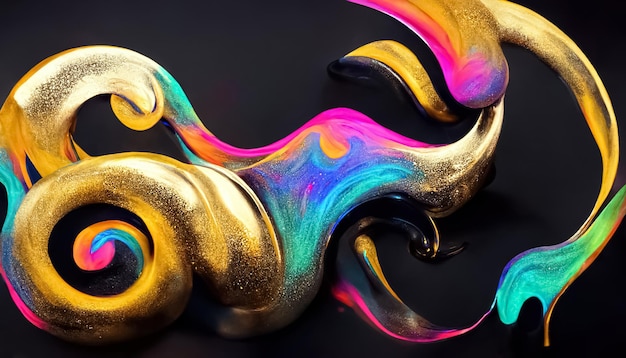
Locate an element on the screen. green paint is located at coordinates click(x=605, y=230).